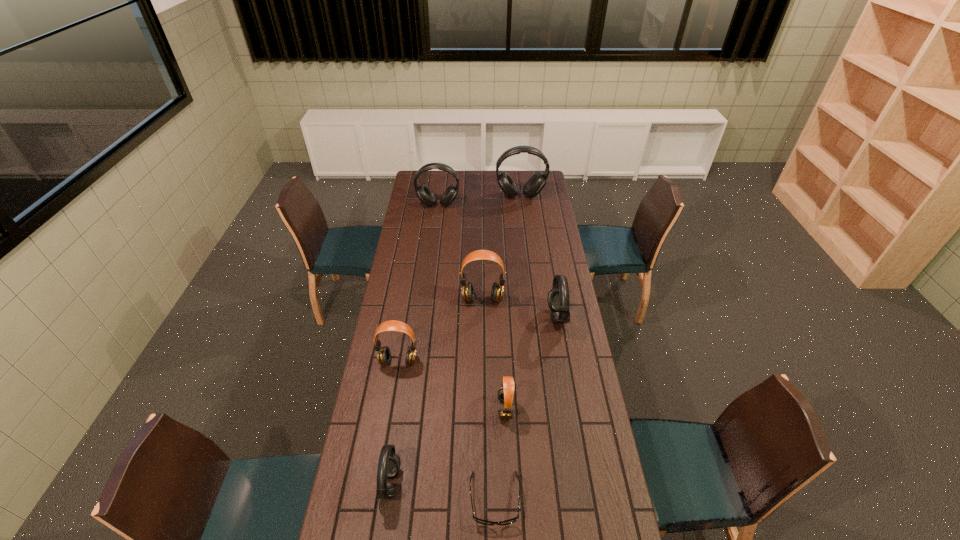
The height and width of the screenshot is (540, 960). In order to click on free space located 0.160m on the ear cups of the sixth farthest object in this screenshot , I will do `click(453, 408)`.

What are the coordinates of `vacant space located 0.210m on the ear cups of the sixth farthest object` in the screenshot? It's located at (439, 408).

Where is `vacant space situated 0.190m on the earcups of the nearest gray headset`? The image size is (960, 540). vacant space situated 0.190m on the earcups of the nearest gray headset is located at coordinates (460, 483).

This screenshot has width=960, height=540. In order to click on object that is at the far edge in this screenshot , I will do `click(537, 181)`.

The image size is (960, 540). Find the location of `object that is positioned at the far right corner`. object that is positioned at the far right corner is located at coordinates (537, 181).

You are a GUI agent. You are given a task and a screenshot of the screen. Output one action in this format:
    pyautogui.click(x=<x>, y=<y>)
    Task: Click on the free space at the far edge of the desktop
    
    Given the screenshot: What is the action you would take?
    pyautogui.click(x=507, y=170)

Locate an element on the screen. This screenshot has height=540, width=960. free space at the left edge is located at coordinates (414, 249).

The image size is (960, 540). I want to click on vacant area at the right edge of the desktop, so click(536, 253).

In the image, there is a desktop. Where is `free region at the far left corner`? This screenshot has width=960, height=540. free region at the far left corner is located at coordinates (412, 181).

Locate an element on the screen. vacant space in between the smallest brown headset and the smallest gray headset is located at coordinates (447, 446).